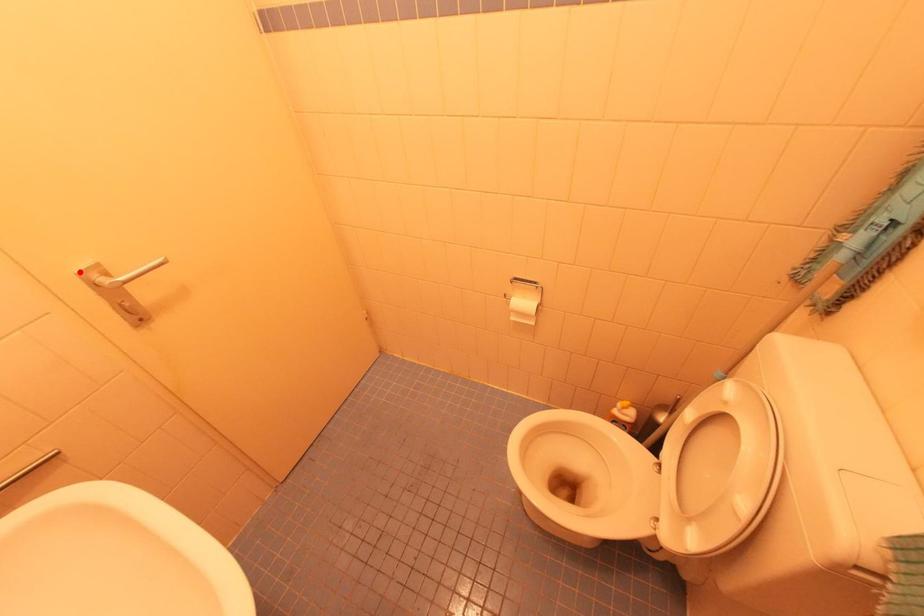
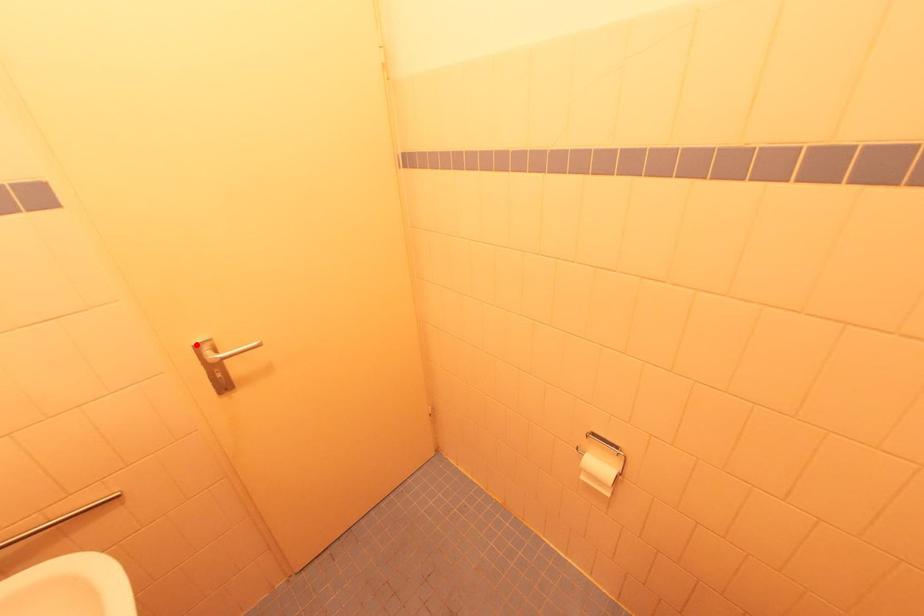
I am providing you with two images of the same scene from different viewpoints. A red point is marked on the first image and another point is marked on the second image. Is the red point in image1 aligned with the point shown in image2?

Yes